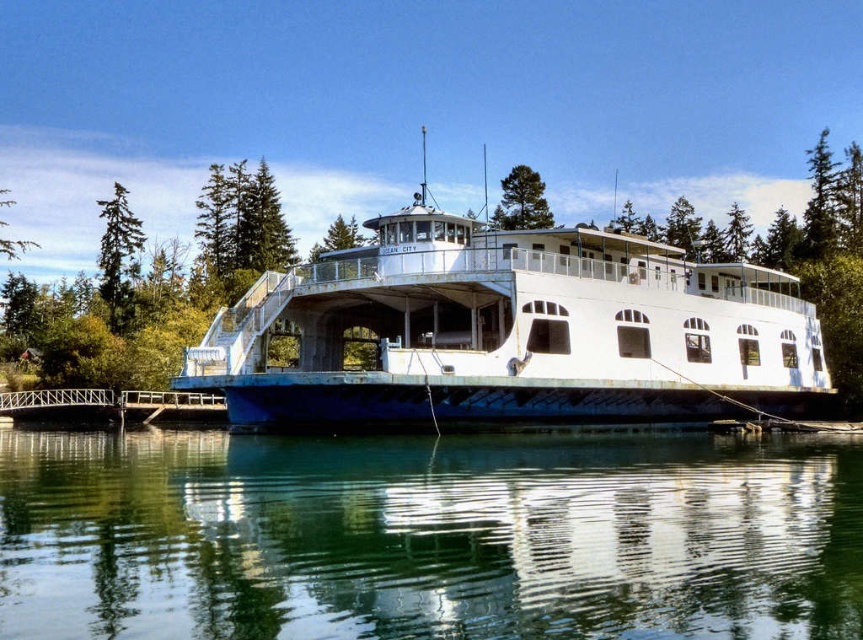
Does white matte boat at center have a lesser width compared to metallic gray dock at lower left?

In fact, white matte boat at center might be wider than metallic gray dock at lower left.

Based on the photo, does white matte boat at center have a smaller size compared to metallic gray dock at lower left?

No, white matte boat at center is not smaller than metallic gray dock at lower left.

Which is behind, point (424, 323) or point (43, 413)?

Positioned behind is point (43, 413).

Identify the location of white matte boat at center. (512, 332).

Is white matte boat at center thinner than green matte tree at upper left?

In fact, white matte boat at center might be wider than green matte tree at upper left.

Is white matte boat at center bigger than green matte tree at upper left?

Correct, white matte boat at center is larger in size than green matte tree at upper left.

Where is `white matte boat at center`? This screenshot has height=640, width=863. white matte boat at center is located at coordinates (512, 332).

What do you see at coordinates (110, 404) in the screenshot?
I see `metallic gray dock at lower left` at bounding box center [110, 404].

Which is behind, point (80, 397) or point (16, 248)?

The point (16, 248) is more distant.

Between point (150, 403) and point (2, 205), which one is positioned behind?

Positioned behind is point (2, 205).

This screenshot has width=863, height=640. Identify the location of metallic gray dock at lower left. (110, 404).